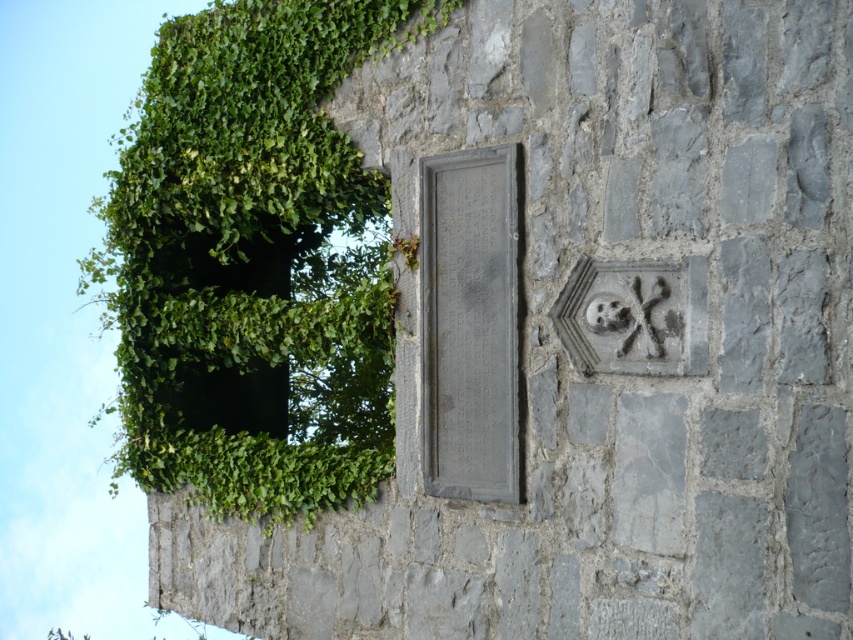
Can you confirm if green leafy plant at upper left is positioned below gray stone plaque at center?

Incorrect, green leafy plant at upper left is not positioned below gray stone plaque at center.

Where is `green leafy plant at upper left`? green leafy plant at upper left is located at coordinates (253, 262).